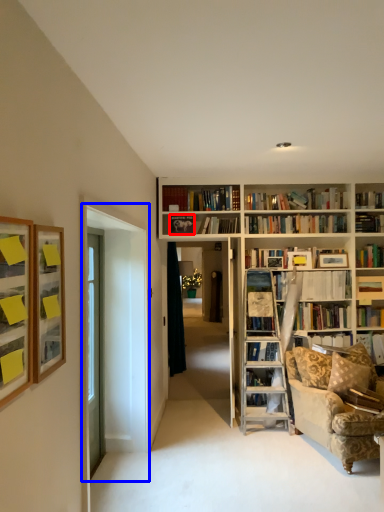
Question: Which of the following is the farthest to the observer, picture frame (highlighted by a red box) or glass door (highlighted by a blue box)?

Choices:
 (A) picture frame
 (B) glass door

Answer: (A)